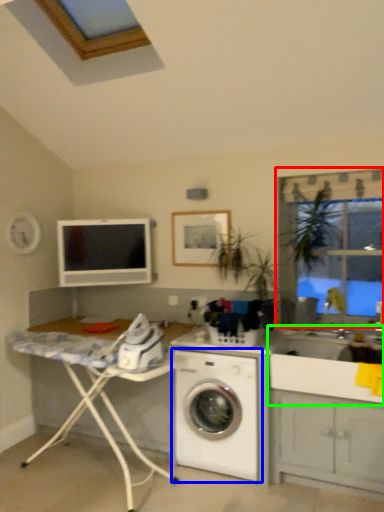
Question: Estimate the real-world distances between objects in this image. Which object is closer to window frame (highlighted by a red box), washing machine (highlighted by a blue box) or sink (highlighted by a green box)?

Choices:
 (A) washing machine
 (B) sink

Answer: (B)